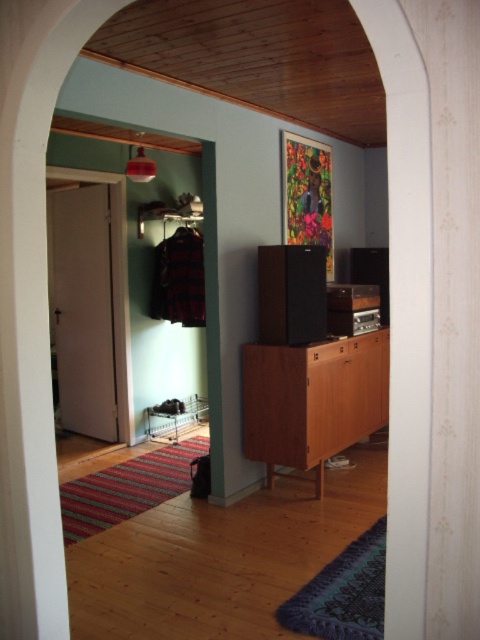
You are standing in the room and want to move from the point at coordinates point (369, 360) to the point at coordinates point (146, 422). According to the scene description, which direction should you move to get closer to your destination?

To move from point (369, 360) to point (146, 422), you should move towards the upper right direction since point (146, 422) is located in the upper right relative to point (369, 360).

You are standing in the room and want to place a new painting that is 1.5 meters wide on the wall. The existing large abstract painting is to the left of the brown wood cabinet at center. Can the new painting fit to the right of the cabinet without overlapping?

The brown wood cabinet at center is located at point (312,400). Since the existing painting is to the left of the cabinet, there might be space to the right. However, without knowing the wall dimensions or the cabinet width, we cannot confirm if the 1.5m painting will fit without overlapping.